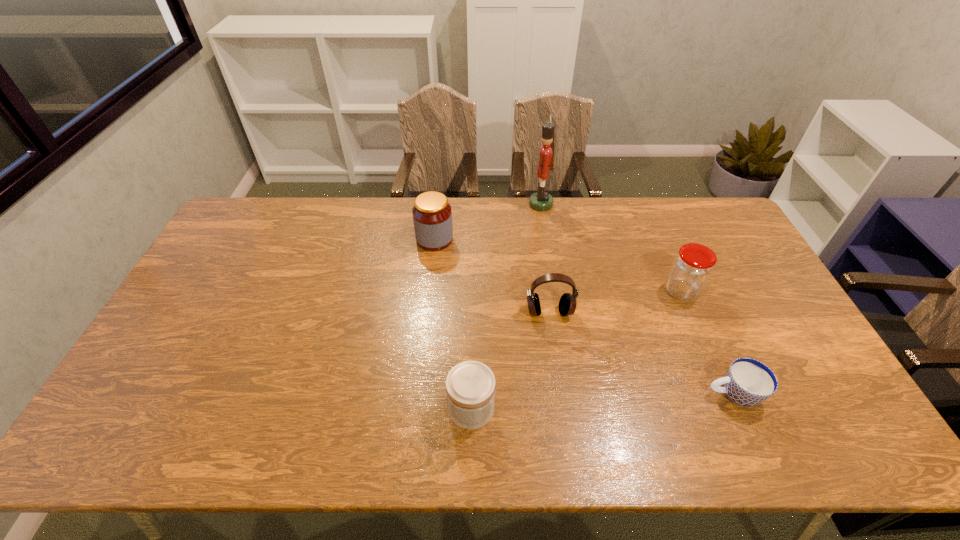
Identify which jar is the closest to the farthest object. Please provide its 2D coordinates. Your answer should be formatted as a tuple, i.e. [(x, y)], where the tuple contains the x and y coordinates of a point satisfying the conditions above.

[(432, 215)]

Locate an element on the screen. This screenshot has width=960, height=540. jar that stands as the third closest to the headset is located at coordinates (432, 215).

Locate an element on the screen. The height and width of the screenshot is (540, 960). vacant region that satisfies the following two spatial constraints: 1. on the front-facing side of the farthest object; 2. on the ear pads of the headset is located at coordinates (558, 312).